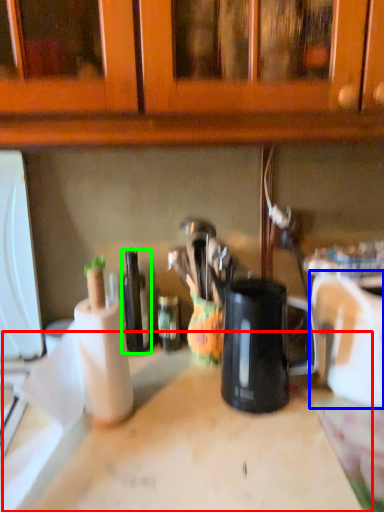
Question: Considering the real-world distances, which object is closest to counter top (highlighted by a red box)? appliance (highlighted by a blue box) or bottle (highlighted by a green box).

Choices:
 (A) appliance
 (B) bottle

Answer: (A)